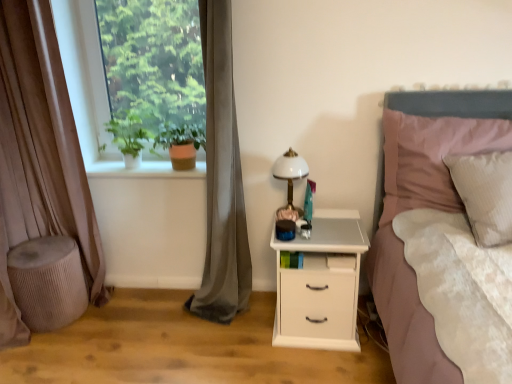
This screenshot has width=512, height=384. Find the location of `free space underneath green matte plant at upper left, positioned as the 1th plant in left-to-right order (from a real-world perspective)`. free space underneath green matte plant at upper left, positioned as the 1th plant in left-to-right order (from a real-world perspective) is located at coordinates (135, 166).